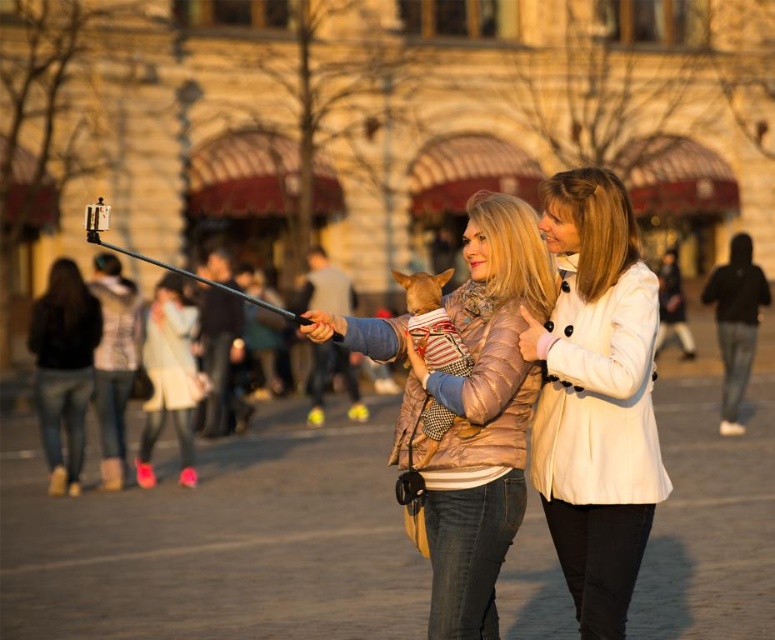
You are a photographer trying to capture a photo of the striped fabric dog at center and the metallic silver pole at center. Based on the scene, which object should you focus on first if you want to ensure both are in focus?

The striped fabric dog at center is taller than the metallic silver pole at center, so you should focus on the striped fabric dog at center first to ensure both are in focus.

You are a photographer trying to capture a photo of the metallic gold jacket at center and the striped fabric dog at center. Which object should you focus on first if you want to ensure both are in the frame without moving the camera?

You should focus on the metallic gold jacket at center first because it is larger in size than the striped fabric dog at center, ensuring it fits within the frame before adjusting for the smaller object.

In the scene shown: You are a photographer trying to capture the white matte coat at center in the city square scene. Where exactly should you position your camera to ensure the coat is in the frame?

Position your camera at point (596, 397) to capture the white matte coat at center.